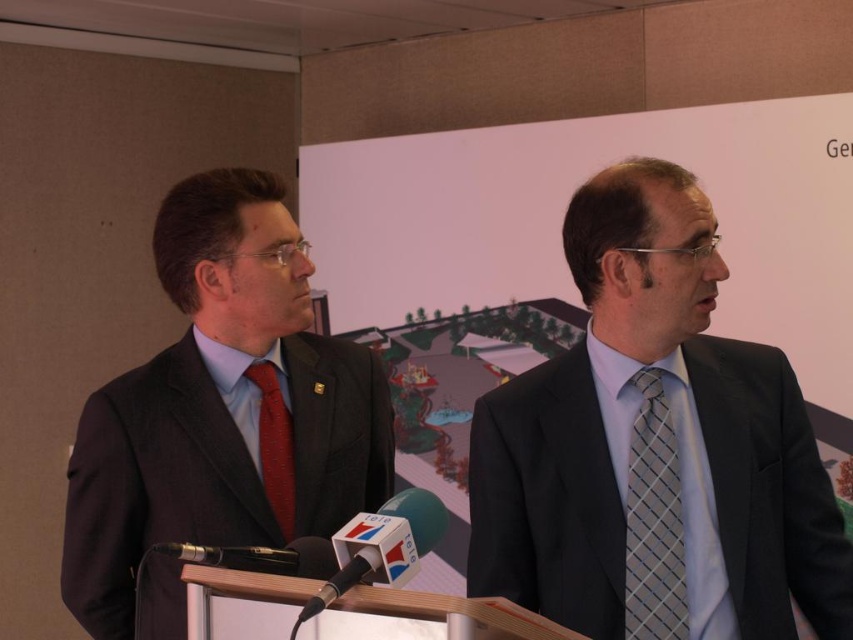
Can you confirm if matte black suit at left is thinner than red silk tie at center?

No, matte black suit at left is not thinner than red silk tie at center.

Does matte black suit at left have a larger size compared to red silk tie at center?

Answer: Yes, matte black suit at left is bigger than red silk tie at center.

At what (x,y) coordinates should I click in order to perform the action: click on matte black suit at left. Please return your answer as a coordinate pair (x, y). Looking at the image, I should click on (223, 406).

Is light blue silk tie at right closer to the viewer compared to red silk tie at center?

Yes, light blue silk tie at right is in front of red silk tie at center.

Between light blue silk tie at right and red silk tie at center, which one has more height?

Standing taller between the two is light blue silk tie at right.

Where is `light blue silk tie at right`? The image size is (853, 640). light blue silk tie at right is located at coordinates (654, 448).

Where is `light blue silk tie at right`? light blue silk tie at right is located at coordinates (654, 448).

Is point (602, 300) positioned behind point (662, 538)?

Yes, it is behind point (662, 538).

Can you confirm if light blue silk tie at right is thinner than gray checkered tie at center?

No, light blue silk tie at right is not thinner than gray checkered tie at center.

This screenshot has height=640, width=853. I want to click on light blue silk tie at right, so click(654, 448).